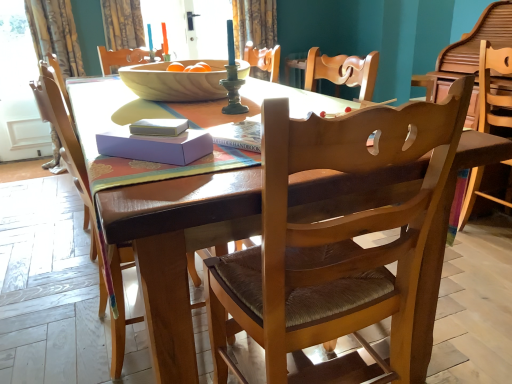
Locate an element on the screen. vacant space to the right of white paper book at center is located at coordinates (230, 135).